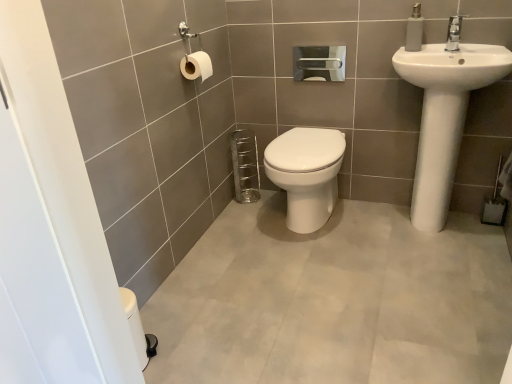
Find the location of `vacant region to the left of white glossy toilet at center`. vacant region to the left of white glossy toilet at center is located at coordinates (229, 231).